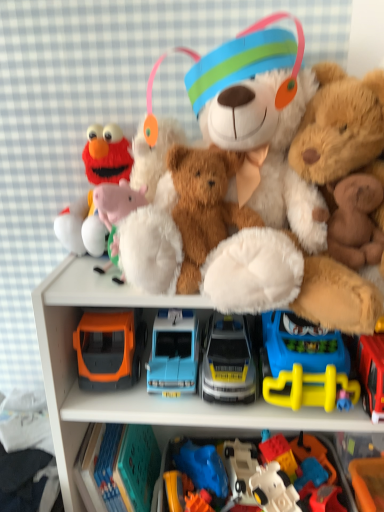
Question: Can you confirm if metallic silver car at center, the 7th toy viewed from the right, is shorter than orange plastic toy car at lower left, the second toy in the left-to-right sequence?

Choices:
 (A) no
 (B) yes

Answer: (B)

Question: Is the depth of metallic silver car at center, which is the 5th toy from left to right, less than that of orange plastic toy car at lower left, the second toy in the left-to-right sequence?

Choices:
 (A) yes
 (B) no

Answer: (A)

Question: Is metallic silver car at center, the 7th toy viewed from the right, wider than orange plastic toy car at lower left, the second toy in the left-to-right sequence?

Choices:
 (A) yes
 (B) no

Answer: (B)

Question: Is metallic silver car at center, which is the 5th toy from left to right, thinner than orange plastic toy car at lower left, which ranks as the tenth toy in right-to-left order?

Choices:
 (A) no
 (B) yes

Answer: (B)

Question: Does metallic silver car at center, which is the 5th toy from left to right, appear on the right side of orange plastic toy car at lower left, the second toy in the left-to-right sequence?

Choices:
 (A) yes
 (B) no

Answer: (A)

Question: In terms of height, does blue plastic car at center, acting as the 4th toy starting from the left, look taller or shorter compared to yellow plastic toy at lower right, which ranks as the 9th toy in left-to-right order?

Choices:
 (A) tall
 (B) short

Answer: (B)

Question: From the image's perspective, is blue plastic car at center, the eighth toy when ordered from right to left, located above or below yellow plastic toy at lower right, which ranks as the 9th toy in left-to-right order?

Choices:
 (A) above
 (B) below

Answer: (B)

Question: From a real-world perspective, is blue plastic car at center, acting as the 4th toy starting from the left, physically located above or below yellow plastic toy at lower right, which ranks as the 9th toy in left-to-right order?

Choices:
 (A) below
 (B) above

Answer: (A)

Question: Is point (180, 351) closer or farther from the camera than point (326, 365)?

Choices:
 (A) farther
 (B) closer

Answer: (A)

Question: Is matte plastic toy car at center, the sixth toy when ordered from left to right, taller or shorter than blue plastic car at center, acting as the 4th toy starting from the left?

Choices:
 (A) short
 (B) tall

Answer: (A)

Question: From a real-world perspective, is matte plastic toy car at center, the sixth toy when ordered from left to right, above or below blue plastic car at center, acting as the 4th toy starting from the left?

Choices:
 (A) below
 (B) above

Answer: (A)

Question: Relative to blue plastic car at center, acting as the 4th toy starting from the left, is matte plastic toy car at center, the sixth toy when ordered from left to right, in front or behind?

Choices:
 (A) front
 (B) behind

Answer: (B)

Question: In terms of size, does matte plastic toy car at center, the sixth toy when ordered from left to right, appear bigger or smaller than blue plastic car at center, acting as the 4th toy starting from the left?

Choices:
 (A) small
 (B) big

Answer: (A)

Question: Is orange plastic toy at lower right, the 1th toy in the right-to-left sequence, situated inside velvet plush elmo at upper left, the first toy viewed from the left, or outside?

Choices:
 (A) inside
 (B) outside

Answer: (B)

Question: From a real-world perspective, is orange plastic toy at lower right, the 1th toy in the right-to-left sequence, above or below velvet plush elmo at upper left, the first toy viewed from the left?

Choices:
 (A) below
 (B) above

Answer: (A)